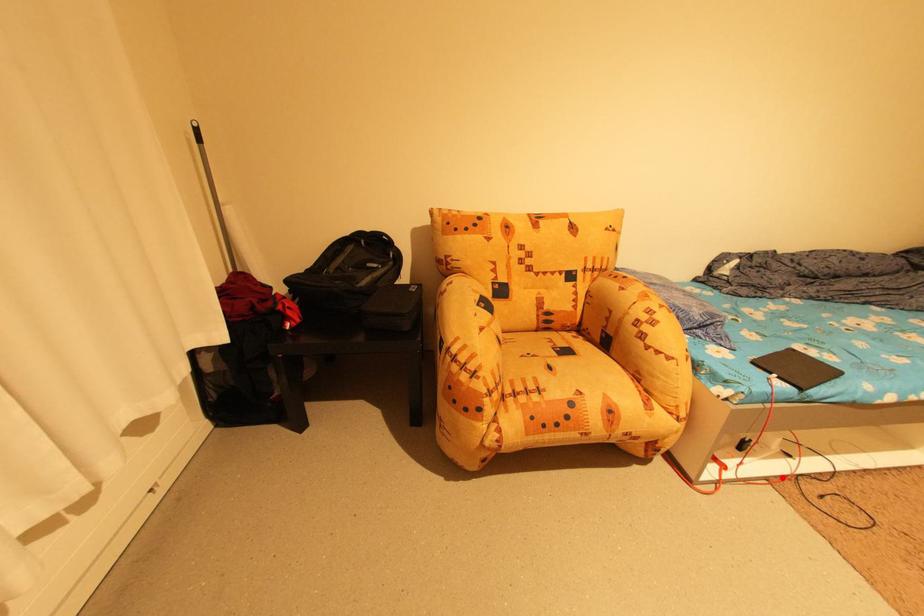
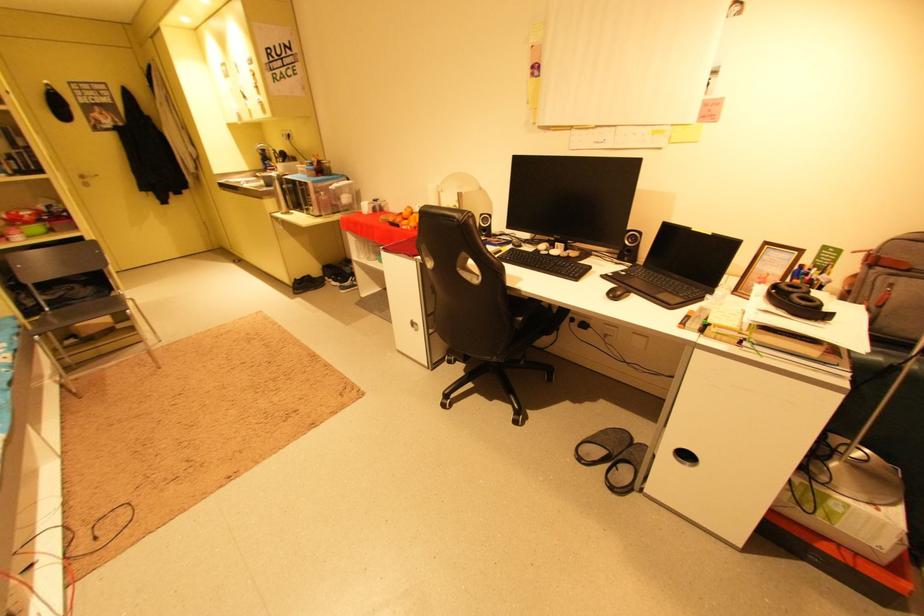
Question: I am providing you with two images of the same scene from different viewpoints. In image1, a red point is highlighted. Considering the same 3D point in image2, which of the following is correct?

Choices:
 (A) It is closer
 (B) It is farther

Answer: (B)